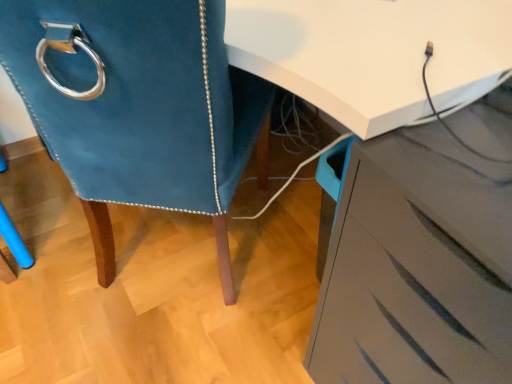
Question: From the image's perspective, is velvet blue chair at left above or below matte gray chest of drawers at lower right?

Choices:
 (A) below
 (B) above

Answer: (B)

Question: Considering their positions, is velvet blue chair at left located in front of or behind matte gray chest of drawers at lower right?

Choices:
 (A) behind
 (B) front

Answer: (A)

Question: Based on their positions, is velvet blue chair at left located to the left or right of matte gray chest of drawers at lower right?

Choices:
 (A) right
 (B) left

Answer: (B)

Question: In terms of width, does matte gray chest of drawers at lower right look wider or thinner when compared to velvet blue chair at left?

Choices:
 (A) wide
 (B) thin

Answer: (B)

Question: From the image's perspective, relative to velvet blue chair at left, is matte gray chest of drawers at lower right above or below?

Choices:
 (A) above
 (B) below

Answer: (B)

Question: Looking at the image, does matte gray chest of drawers at lower right seem bigger or smaller compared to velvet blue chair at left?

Choices:
 (A) big
 (B) small

Answer: (B)

Question: Is point (394, 278) positioned closer to the camera than point (125, 200)?

Choices:
 (A) farther
 (B) closer

Answer: (B)